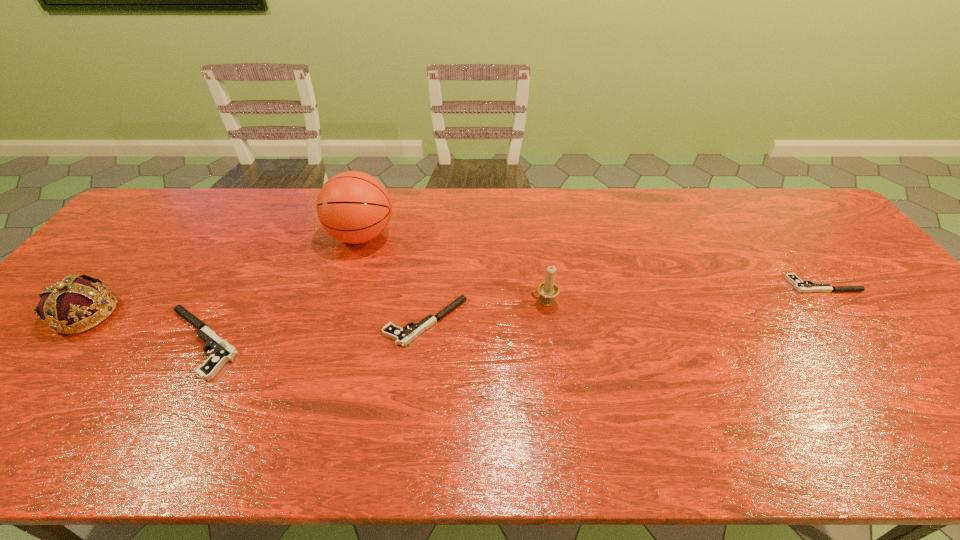
Please determine a free point for an extra pistol to ensure balance. Please provide its 2D coordinates. Your answer should be formatted as a tuple, i.e. [(x, y)], where the tuple contains the x and y coordinates of a point satisfying the conditions above.

[(632, 302)]